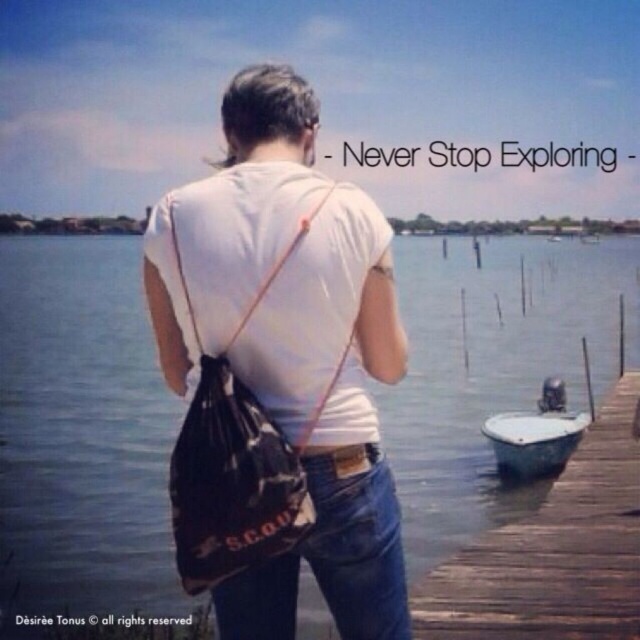
What is the object located at the coordinates point (554, 552) in the image?

The point (554, 552) corresponds to the wooden dock at right.